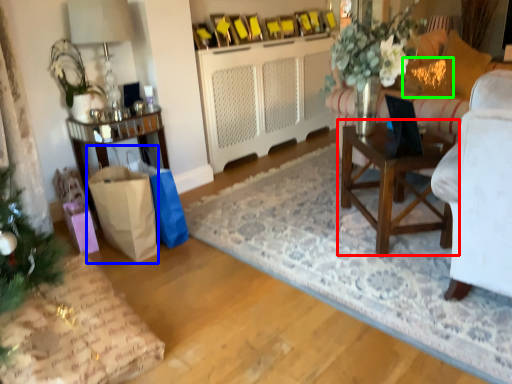
Question: Which object is positioned closest to table (highlighted by a red box)? Select from shopping bag (highlighted by a blue box) and pillow (highlighted by a green box).

Choices:
 (A) shopping bag
 (B) pillow

Answer: (B)